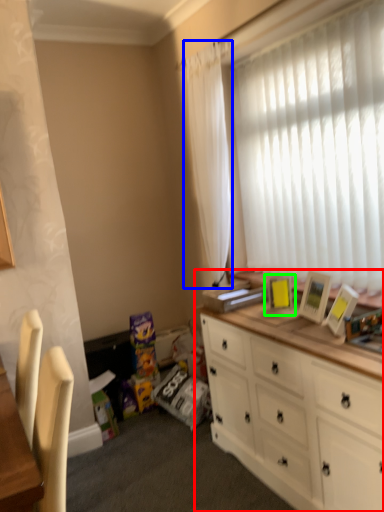
Question: Which is farther away from cabinetry (highlighted by a red box)? curtain (highlighted by a blue box) or picture frame (highlighted by a green box)?

Choices:
 (A) curtain
 (B) picture frame

Answer: (A)